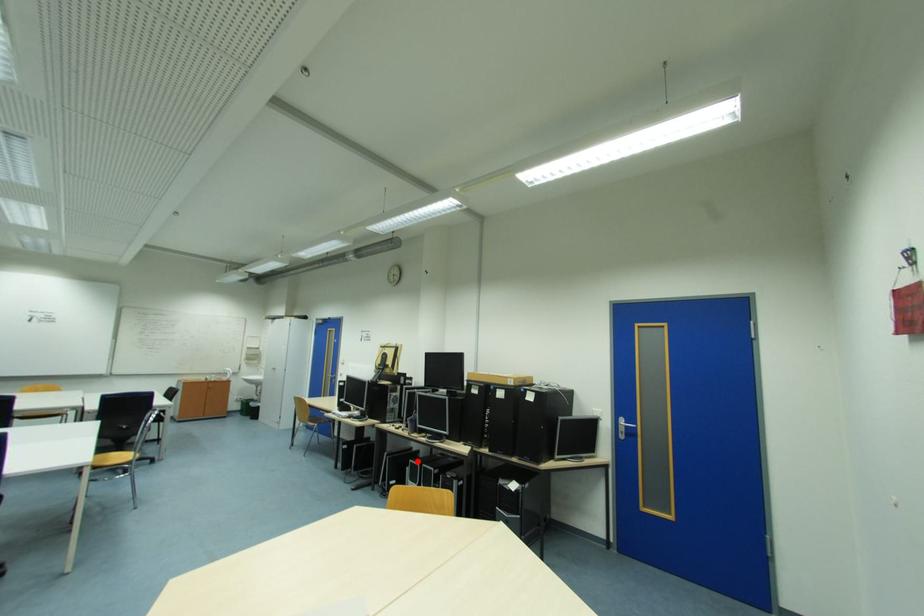
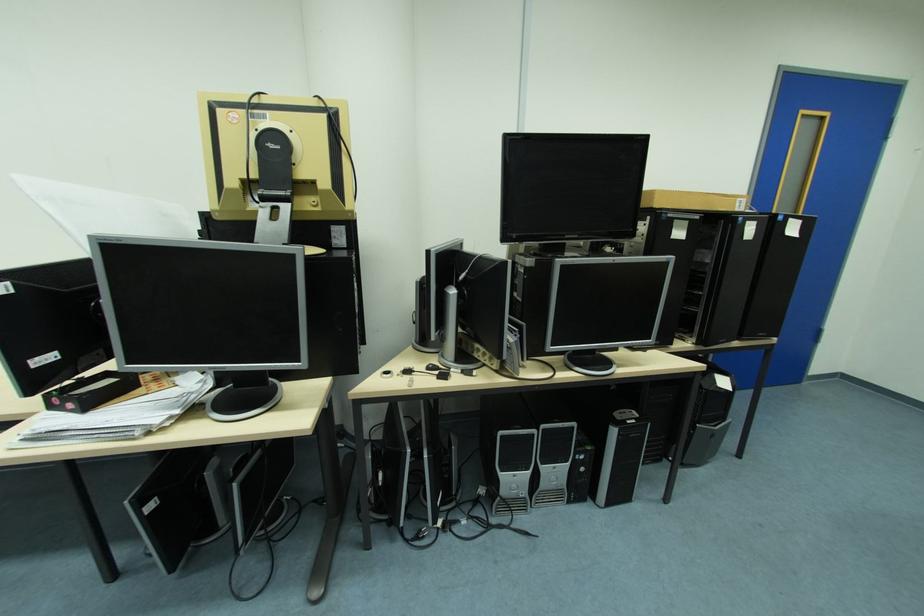
Question: I am providing you with two images of the same scene from different viewpoints. Image1 has a red point marked. In image2, the corresponding 3D location appears at what relative position? Reply with the corresponding letter.

Choices:
 (A) Closer
 (B) Farther

Answer: (A)